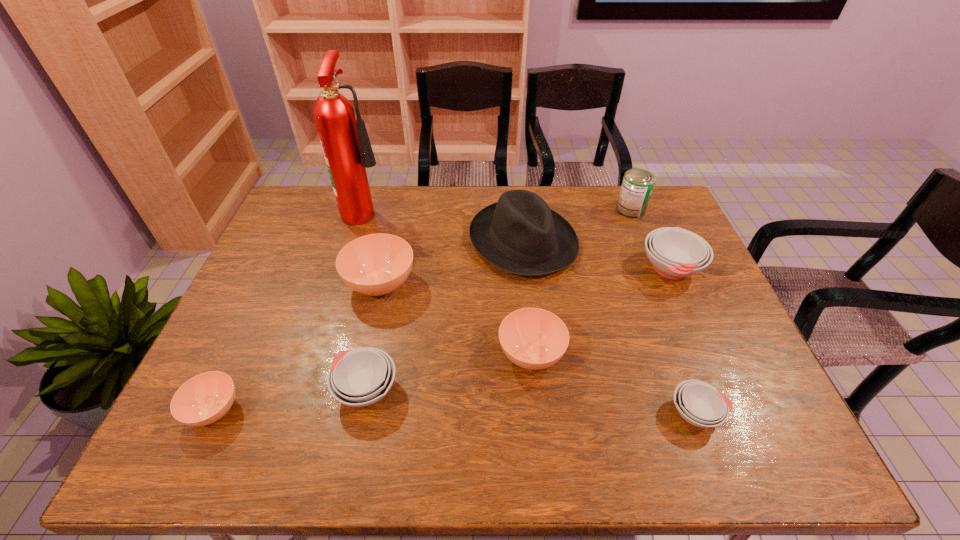
What are the coordinates of `the closest peach soup bowl to the leftmost soup bowl` in the screenshot? It's located at (377, 264).

Locate an element on the screen. The image size is (960, 540). white soup bowl that is the second closest one to the smallest peach soup bowl is located at coordinates (700, 404).

Identify which white soup bowl is located as the nearest to the biggest white soup bowl. Please provide its 2D coordinates. Your answer should be formatted as a tuple, i.e. [(x, y)], where the tuple contains the x and y coordinates of a point satisfying the conditions above.

[(700, 404)]

Image resolution: width=960 pixels, height=540 pixels. In order to click on free space that satisfies the following two spatial constraints: 1. on the back side of the second nearest peach soup bowl; 2. on the left side of the fedora in this screenshot , I will do `click(520, 241)`.

Locate an element on the screen. blank area in the image that satisfies the following two spatial constraints: 1. on the back side of the biggest white soup bowl; 2. on the left side of the second biggest white soup bowl is located at coordinates (x=392, y=269).

Locate an element on the screen. vacant space that satisfies the following two spatial constraints: 1. at the nozzle of the second peach soup bowl from left to right; 2. on the left side of the tallest object is located at coordinates (344, 284).